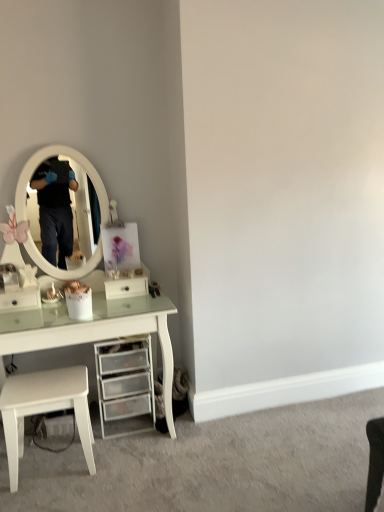
The height and width of the screenshot is (512, 384). Identify the location of vacant region above white glossy drawer at center, marked as the second drawer in a left-to-right arrangement (from a real-world perspective). (122, 276).